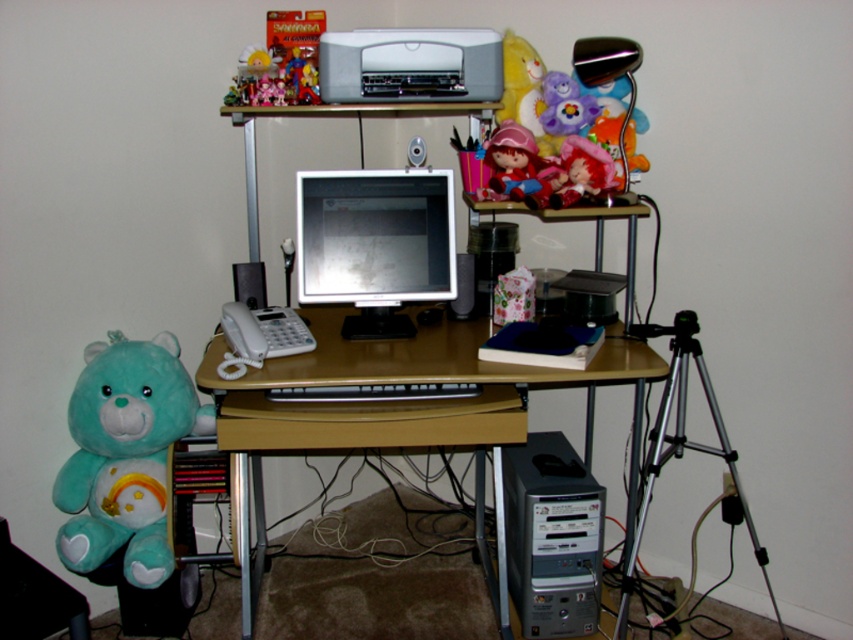
In the scene shown: Who is higher up, black plastic speaker at left or black plastic speaker at center?

black plastic speaker at left is above.

Who is lower down, black plastic speaker at left or black plastic speaker at center?

Positioned lower is black plastic speaker at center.

Locate an element on the screen. The height and width of the screenshot is (640, 853). black plastic speaker at left is located at coordinates (248, 284).

Locate an element on the screen. The width and height of the screenshot is (853, 640). black plastic speaker at left is located at coordinates (248, 284).

Is matte plastic doll at center in front of black plastic speaker at left?

That is True.

Does point (505, 124) lie behind point (254, 262)?

No.

Identify the location of matte plastic doll at center. (517, 166).

Is teal plush bear at left positioned at the back of silver metallic desktop tower at lower center?

No, teal plush bear at left is closer to the viewer.

Describe the element at coordinates (125, 454) in the screenshot. I see `teal plush bear at left` at that location.

Is point (90, 433) in front of point (546, 460)?

Yes, it is in front of point (546, 460).

At what (x,y) coordinates should I click in order to perform the action: click on teal plush bear at left. Please return your answer as a coordinate pair (x, y). This screenshot has height=640, width=853. Looking at the image, I should click on (125, 454).